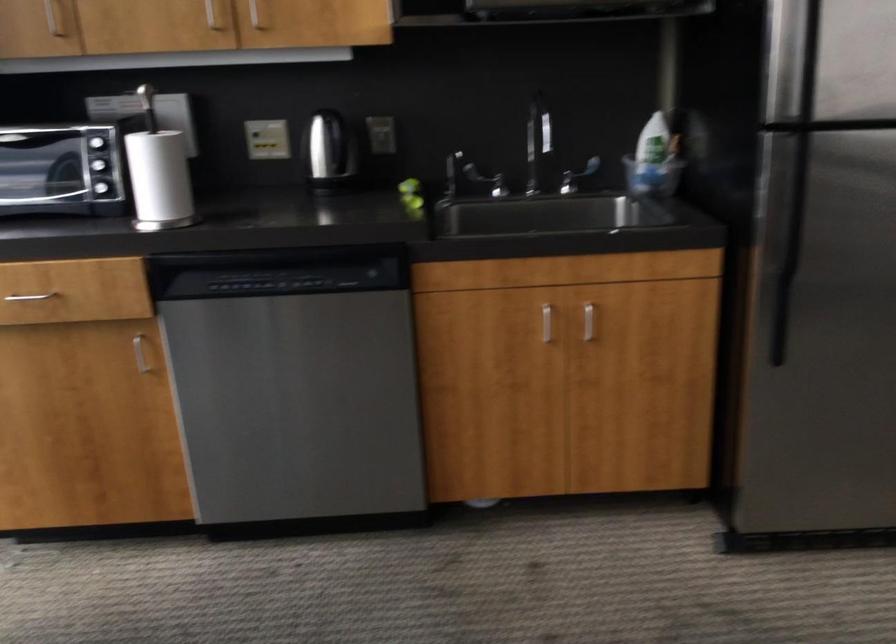
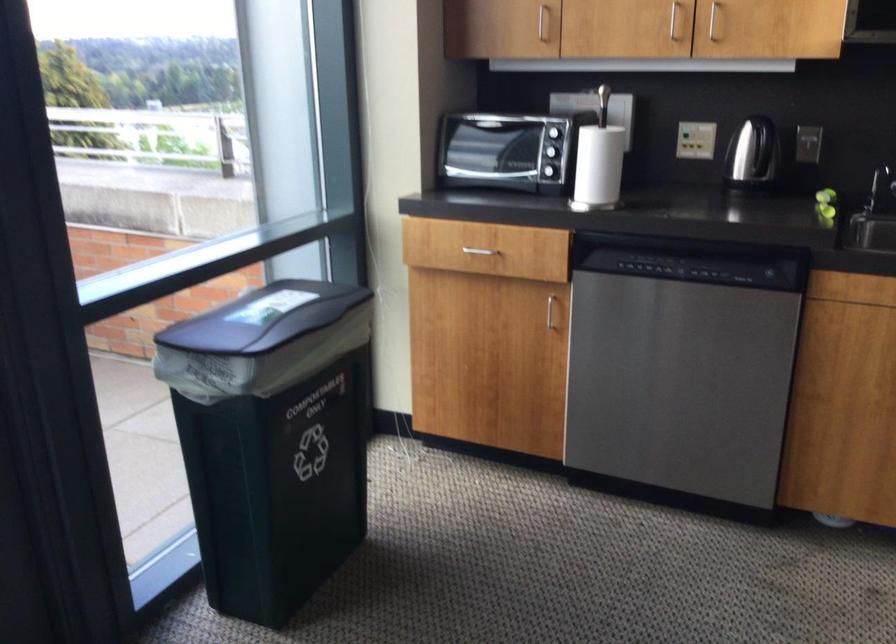
In the second image, find the point that corresponds to the point at 333,154 in the first image.

(752, 152)